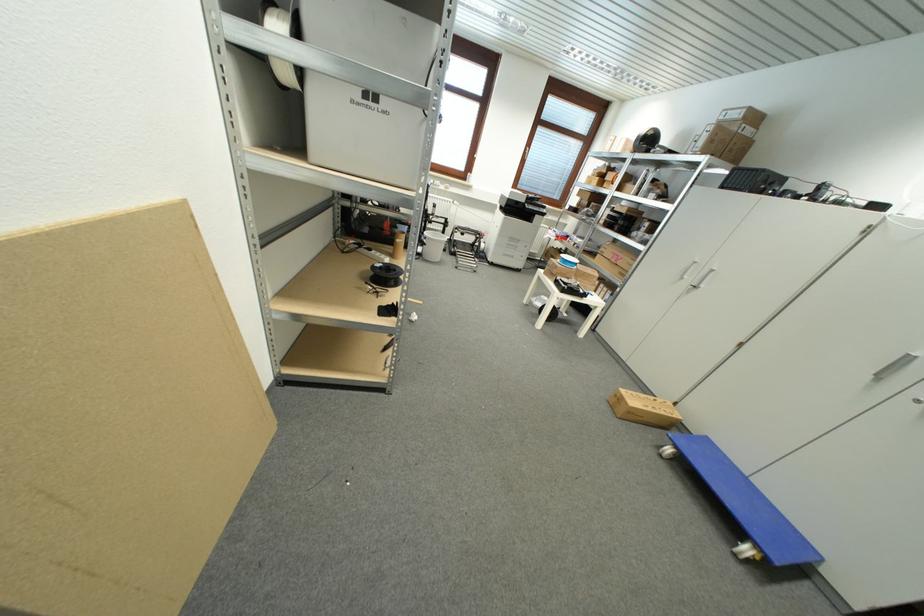
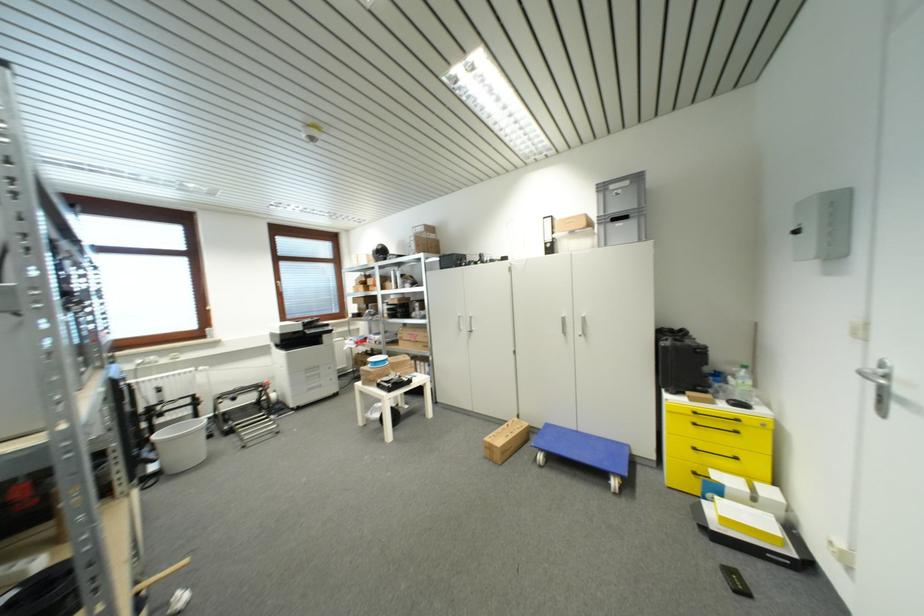
Question: How did the camera likely rotate?

Choices:
 (A) Left
 (B) Right
 (C) Up
 (D) Down

Answer: (B)